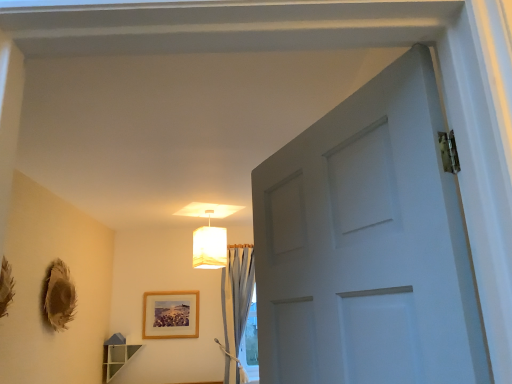
Question: Considering the relative sizes of wooden frame at center and light blue sheer curtain at center in the image provided, is wooden frame at center taller than light blue sheer curtain at center?

Choices:
 (A) yes
 (B) no

Answer: (B)

Question: Considering the relative sizes of wooden frame at center and light blue sheer curtain at center in the image provided, is wooden frame at center wider than light blue sheer curtain at center?

Choices:
 (A) yes
 (B) no

Answer: (B)

Question: Is wooden frame at center further to camera compared to light blue sheer curtain at center?

Choices:
 (A) no
 (B) yes

Answer: (B)

Question: Is wooden frame at center outside light blue sheer curtain at center?

Choices:
 (A) yes
 (B) no

Answer: (A)

Question: Is wooden frame at center with light blue sheer curtain at center?

Choices:
 (A) no
 (B) yes

Answer: (A)

Question: From the image's perspective, would you say wooden frame at center is positioned over light blue sheer curtain at center?

Choices:
 (A) no
 (B) yes

Answer: (A)

Question: Considering the relative sizes of white fabric lampshade at upper center and wooden frame at center in the image provided, is white fabric lampshade at upper center thinner than wooden frame at center?

Choices:
 (A) yes
 (B) no

Answer: (B)

Question: From the image's perspective, is white fabric lampshade at upper center on top of wooden frame at center?

Choices:
 (A) yes
 (B) no

Answer: (A)

Question: Does white fabric lampshade at upper center have a smaller size compared to wooden frame at center?

Choices:
 (A) no
 (B) yes

Answer: (A)

Question: Can we say white fabric lampshade at upper center lies outside wooden frame at center?

Choices:
 (A) no
 (B) yes

Answer: (B)

Question: Does white fabric lampshade at upper center come behind wooden frame at center?

Choices:
 (A) yes
 (B) no

Answer: (B)

Question: From a real-world perspective, is white fabric lampshade at upper center over wooden frame at center?

Choices:
 (A) no
 (B) yes

Answer: (B)

Question: From the image's perspective, is light blue sheer curtain at center located beneath wooden frame at center?

Choices:
 (A) no
 (B) yes

Answer: (A)